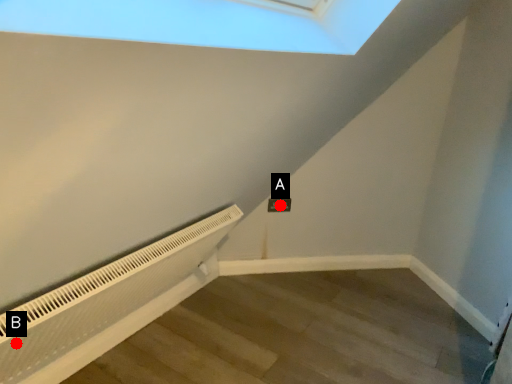
Question: Two points are circled on the image, labeled by A and B beside each circle. Which point is closer to the camera taking this photo?

Choices:
 (A) A is closer
 (B) B is closer

Answer: (B)